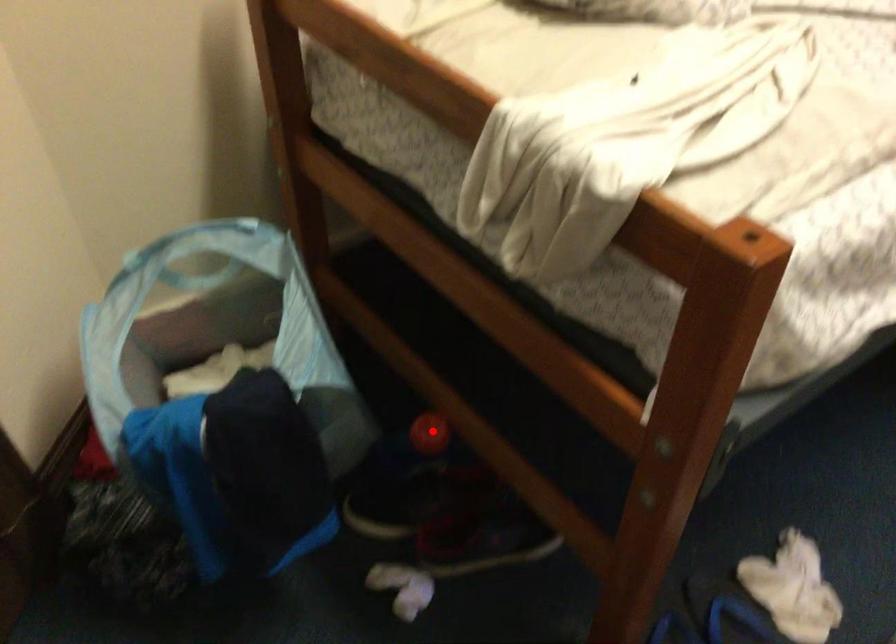
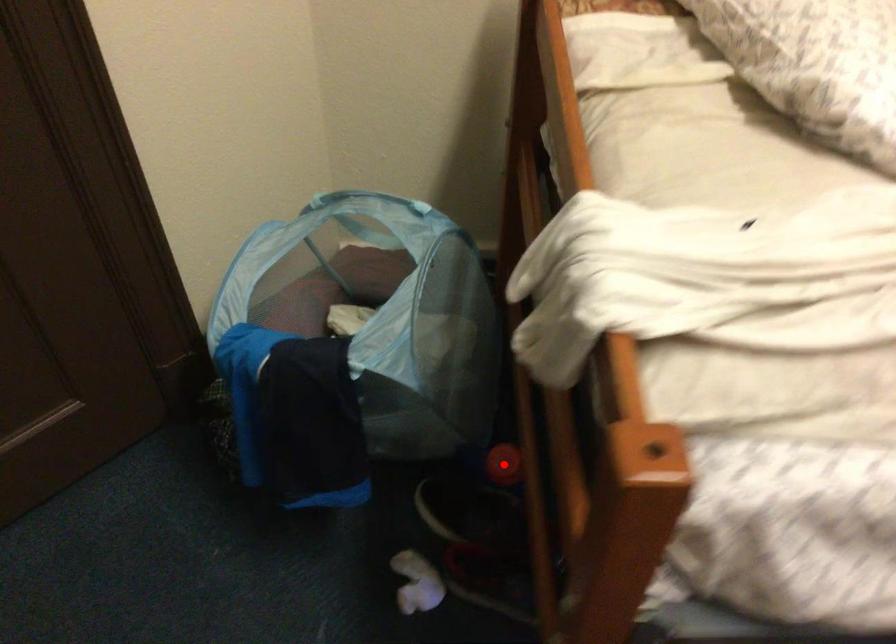
I am providing you with two images of the same scene from different viewpoints. A red point is marked on the first image and another point is marked on the second image. Do the highlighted points in image1 and image2 indicate the same real-world spot?

Yes